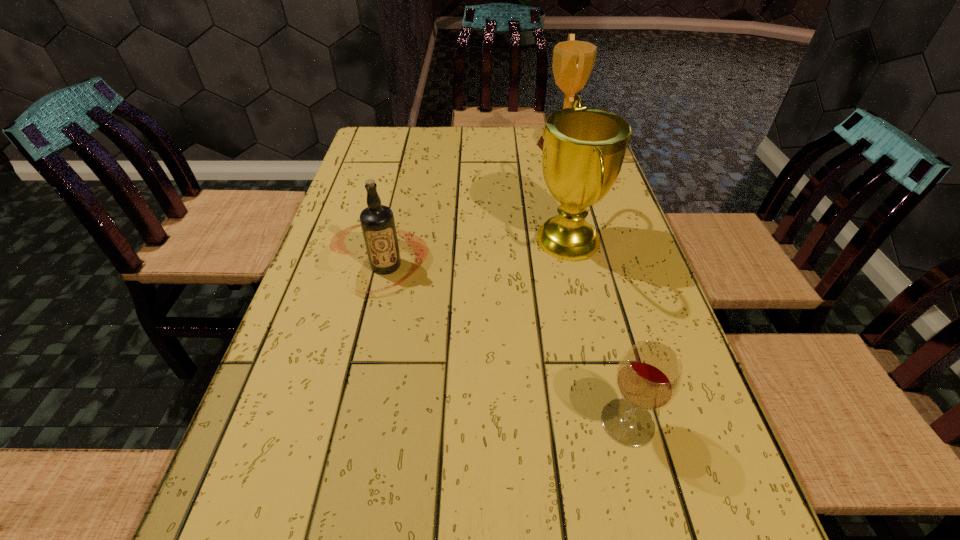
The width and height of the screenshot is (960, 540). What are the coordinates of `the farther award` in the screenshot? It's located at (573, 61).

Locate an element on the screen. The image size is (960, 540). the nearer award is located at coordinates (584, 148).

The height and width of the screenshot is (540, 960). Identify the location of root beer. (x=377, y=221).

The image size is (960, 540). What are the coordinates of `the leftmost object` in the screenshot? It's located at (377, 221).

The height and width of the screenshot is (540, 960). I want to click on wineglass, so click(x=649, y=375).

Locate an element on the screen. This screenshot has width=960, height=540. the shortest object is located at coordinates (649, 375).

In order to click on vacant space positioned 0.310m on the front-facing side of the farther award in this screenshot , I will do `click(444, 145)`.

Identify the location of free region located 0.350m on the front-facing side of the farther award. (431, 145).

The height and width of the screenshot is (540, 960). Identify the location of vacant space located 0.390m on the front-facing side of the farther award. (420, 145).

Locate an element on the screen. The width and height of the screenshot is (960, 540). vacant region located 0.380m on the shiny surface of the nearer award is located at coordinates (380, 241).